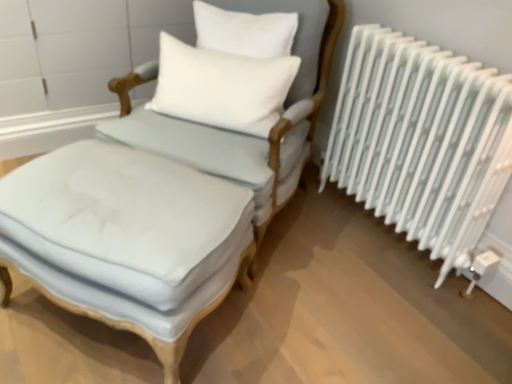
Question: Considering the relative sizes of white metal radiator at right and light blue fabric chair at center in the image provided, is white metal radiator at right smaller than light blue fabric chair at center?

Choices:
 (A) no
 (B) yes

Answer: (B)

Question: Is light blue fabric chair at center surrounded by white metal radiator at right?

Choices:
 (A) no
 (B) yes

Answer: (A)

Question: Is white metal radiator at right closer to camera compared to light blue fabric chair at center?

Choices:
 (A) no
 (B) yes

Answer: (A)

Question: From a real-world perspective, does white metal radiator at right stand above light blue fabric chair at center?

Choices:
 (A) no
 (B) yes

Answer: (B)

Question: Can you confirm if white metal radiator at right is wider than light blue fabric chair at center?

Choices:
 (A) yes
 (B) no

Answer: (B)

Question: From a real-world perspective, relative to light blue fabric ottoman at center, is white soft cushion at upper center vertically above or below?

Choices:
 (A) above
 (B) below

Answer: (A)

Question: From the image's perspective, is white soft cushion at upper center above or below light blue fabric ottoman at center?

Choices:
 (A) below
 (B) above

Answer: (B)

Question: Choose the correct answer: Is white soft cushion at upper center inside light blue fabric ottoman at center or outside it?

Choices:
 (A) outside
 (B) inside

Answer: (A)

Question: In terms of size, does white soft cushion at upper center appear bigger or smaller than light blue fabric ottoman at center?

Choices:
 (A) big
 (B) small

Answer: (B)

Question: Is light blue fabric ottoman at center situated inside white metal radiator at right or outside?

Choices:
 (A) inside
 (B) outside

Answer: (B)

Question: Looking at the image, does light blue fabric ottoman at center seem bigger or smaller compared to white metal radiator at right?

Choices:
 (A) big
 (B) small

Answer: (A)

Question: From a real-world perspective, relative to white metal radiator at right, is light blue fabric ottoman at center vertically above or below?

Choices:
 (A) below
 (B) above

Answer: (A)

Question: Based on their positions, is light blue fabric ottoman at center located to the left or right of white metal radiator at right?

Choices:
 (A) right
 (B) left

Answer: (B)

Question: Considering their positions, is light blue fabric armchair at center located in front of or behind light blue fabric chair at center?

Choices:
 (A) behind
 (B) front

Answer: (A)

Question: Do you think light blue fabric armchair at center is within light blue fabric chair at center, or outside of it?

Choices:
 (A) inside
 (B) outside

Answer: (B)